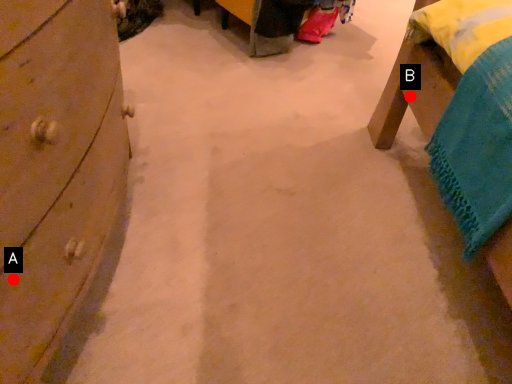
Question: Two points are circled on the image, labeled by A and B beside each circle. Which of the following is the farthest from the observer?

Choices:
 (A) A is further
 (B) B is further

Answer: (B)